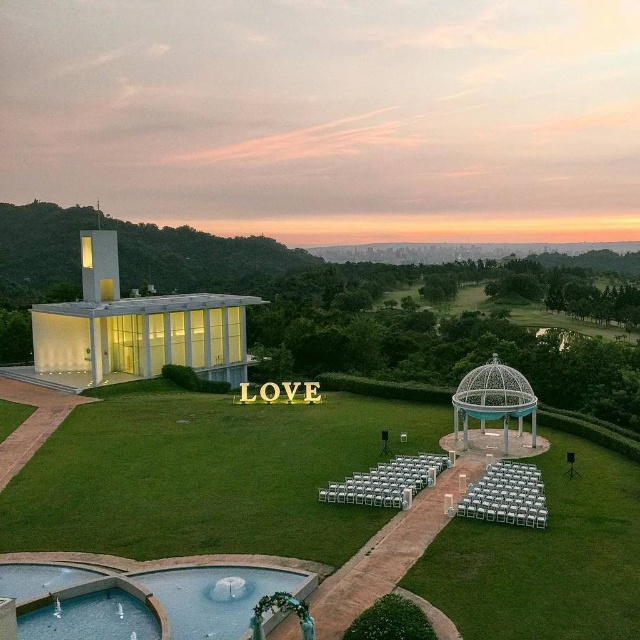
Question: In this image, where is clear glass water at lower center located relative to matte glass gazebo at center?

Choices:
 (A) below
 (B) above

Answer: (A)

Question: Where is clear glass water at lower center located in relation to matte glass gazebo at center in the image?

Choices:
 (A) below
 (B) above

Answer: (A)

Question: Does green grass lawn at center have a lesser width compared to clear glass water at lower center?

Choices:
 (A) yes
 (B) no

Answer: (B)

Question: Which is farther from the matte glass gazebo at center?

Choices:
 (A) green grass lawn at center
 (B) green grassy hillside at upper left
 (C) white metal gazebo at center
 (D) clear glass water at lower center

Answer: (D)

Question: Which object is positioned closest to the green grassy hillside at upper left?

Choices:
 (A) clear glass water at lower center
 (B) green grass lawn at center
 (C) matte glass gazebo at center
 (D) white metal gazebo at center

Answer: (C)

Question: Among these points, which one is nearest to the camera?

Choices:
 (A) (492, 410)
 (B) (29, 586)

Answer: (B)